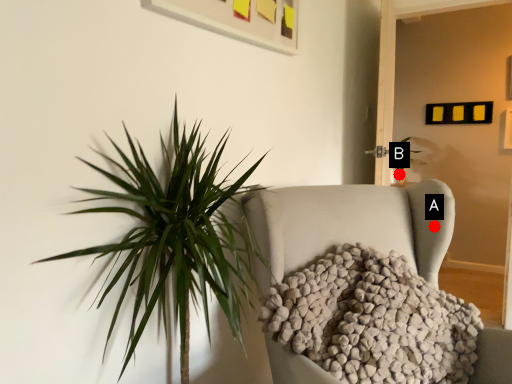
Question: Two points are circled on the image, labeled by A and B beside each circle. Among these points, which one is farthest from the camera?

Choices:
 (A) A is further
 (B) B is further

Answer: (B)